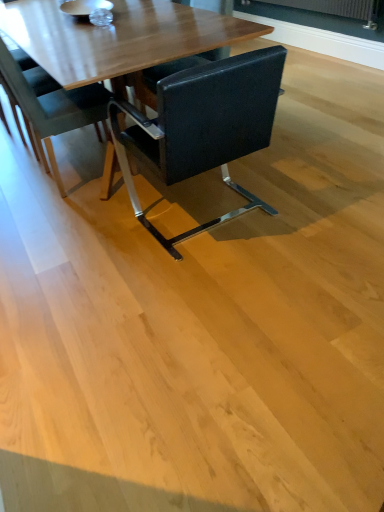
The width and height of the screenshot is (384, 512). Find the location of `vacant space to the right of black leather chair at center, arranged as the 1th chair when viewed from the right`. vacant space to the right of black leather chair at center, arranged as the 1th chair when viewed from the right is located at coordinates (306, 195).